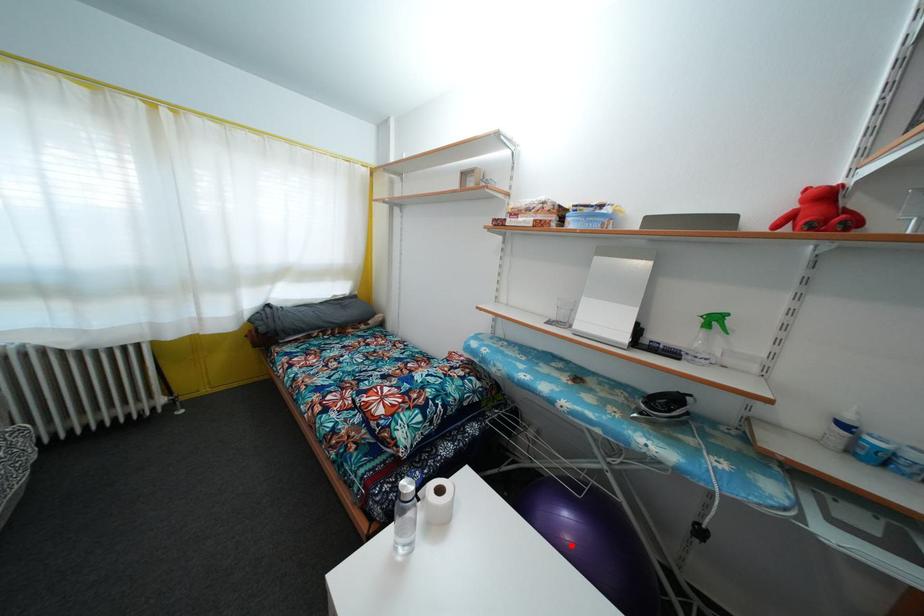
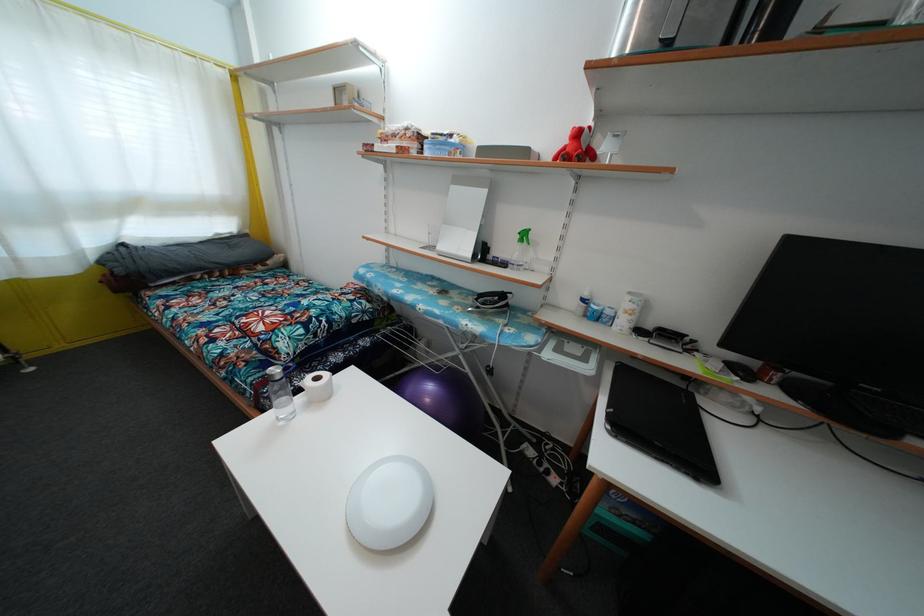
Question: I am providing you with two images of the same scene from different viewpoints. A red point is marked on the first image. At the location where the point appears in image 1, is it still visible in image 2?

Choices:
 (A) Yes
 (B) No

Answer: (A)